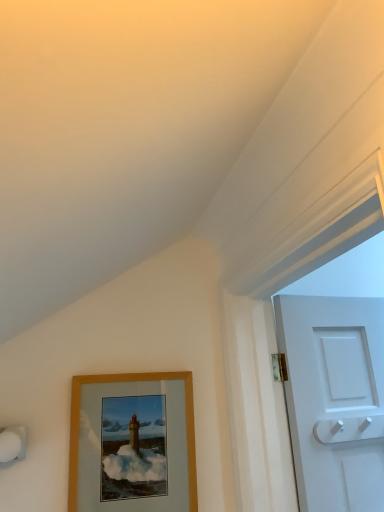
Question: Considering the relative sizes of wooden frame at lower left and white plastic door handle at right in the image provided, is wooden frame at lower left wider than white plastic door handle at right?

Choices:
 (A) no
 (B) yes

Answer: (A)

Question: Is wooden frame at lower left directly adjacent to white plastic door handle at right?

Choices:
 (A) no
 (B) yes

Answer: (A)

Question: Considering the relative positions of wooden frame at lower left and white plastic door handle at right in the image provided, is wooden frame at lower left behind white plastic door handle at right?

Choices:
 (A) yes
 (B) no

Answer: (B)

Question: Considering the relative sizes of wooden frame at lower left and white plastic door handle at right in the image provided, is wooden frame at lower left thinner than white plastic door handle at right?

Choices:
 (A) no
 (B) yes

Answer: (B)

Question: Is wooden frame at lower left looking in the opposite direction of white plastic door handle at right?

Choices:
 (A) yes
 (B) no

Answer: (B)

Question: Is wooden frame at lower left in front of white plastic door handle at right?

Choices:
 (A) yes
 (B) no

Answer: (A)

Question: Does white plastic door handle at right have a lesser height compared to wooden frame at lower left?

Choices:
 (A) yes
 (B) no

Answer: (A)

Question: Is white plastic door handle at right placed right next to wooden frame at lower left?

Choices:
 (A) yes
 (B) no

Answer: (B)

Question: Considering the relative sizes of white plastic door handle at right and wooden frame at lower left in the image provided, is white plastic door handle at right wider than wooden frame at lower left?

Choices:
 (A) yes
 (B) no

Answer: (A)

Question: Does white plastic door handle at right turn towards wooden frame at lower left?

Choices:
 (A) yes
 (B) no

Answer: (B)

Question: Is white plastic door handle at right closer to the viewer compared to wooden frame at lower left?

Choices:
 (A) yes
 (B) no

Answer: (B)

Question: From a real-world perspective, is white plastic door handle at right physically above wooden frame at lower left?

Choices:
 (A) yes
 (B) no

Answer: (A)

Question: From the image's perspective, is wooden frame at lower left located above or below white plastic door handle at right?

Choices:
 (A) below
 (B) above

Answer: (A)